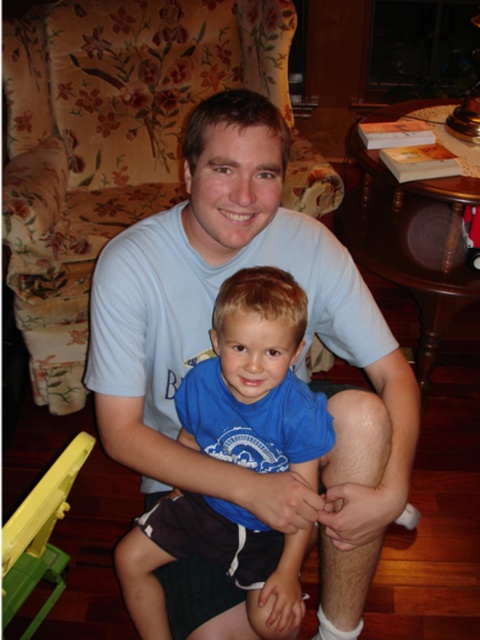
Is point (21, 29) in front of point (276, 282)?

No.

Between point (67, 4) and point (276, 531), which one is positioned in front?

Positioned in front is point (276, 531).

Measure the distance between point (69, 100) and camera.

Point (69, 100) and camera are 2.11 meters apart.

Find the location of a particular element. This screenshot has width=480, height=640. floral fabric armchair at upper left is located at coordinates (108, 144).

Between light blue t-shirt at center and floral fabric armchair at upper left, which one has more height?

With more height is floral fabric armchair at upper left.

Can you confirm if light blue t-shirt at center is wider than floral fabric armchair at upper left?

Incorrect, light blue t-shirt at center's width does not surpass floral fabric armchair at upper left's.

I want to click on light blue t-shirt at center, so tap(210, 352).

Between light blue t-shirt at center and blue cotton shirt at center, which one is positioned higher?

Positioned higher is light blue t-shirt at center.

Who is lower down, light blue t-shirt at center or blue cotton shirt at center?

blue cotton shirt at center is below.

This screenshot has width=480, height=640. Identify the location of light blue t-shirt at center. (210, 352).